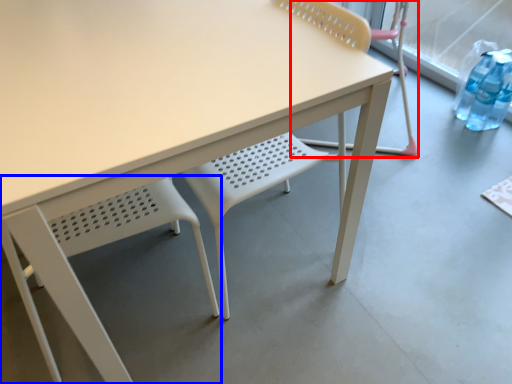
Question: Which object is closer to the camera taking this photo, chair (highlighted by a red box) or chair (highlighted by a blue box)?

Choices:
 (A) chair
 (B) chair

Answer: (B)